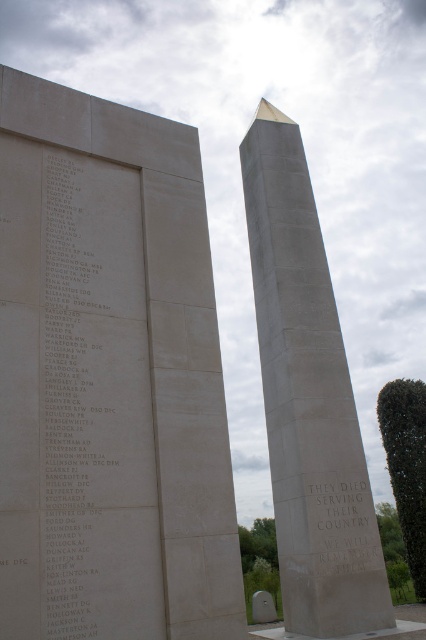
Question: Is white stone obelisk at center smaller than white stone plaque at left?

Choices:
 (A) no
 (B) yes

Answer: (A)

Question: Which is farther from the white stone plaque at left?

Choices:
 (A) white stone text at center
 (B) white stone obelisk at center

Answer: (A)

Question: Which object is closer to the camera taking this photo?

Choices:
 (A) white stone plaque at left
 (B) matte stone memorial at center

Answer: (A)

Question: Can you confirm if white stone obelisk at center is thinner than white stone plaque at left?

Choices:
 (A) yes
 (B) no

Answer: (B)

Question: Considering the real-world distances, which object is farthest from the white stone plaque at left?

Choices:
 (A) matte stone memorial at center
 (B) white stone text at center

Answer: (B)

Question: In this image, where is white stone obelisk at center located relative to white stone text at center?

Choices:
 (A) above
 (B) below

Answer: (A)